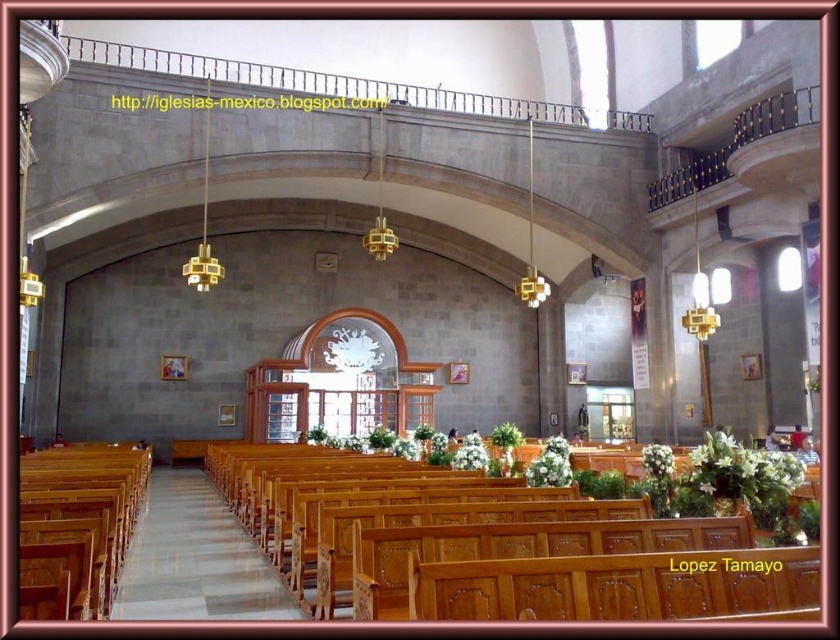
You are a visitor in the church and want to take a photo of the white matte floral arrangement at center and the white matte flower at center. Which one should you focus on if you want to capture the object that takes up more space in the frame?

The white matte flower at center takes up more space in the frame because it occupies more space than the white matte floral arrangement at center.